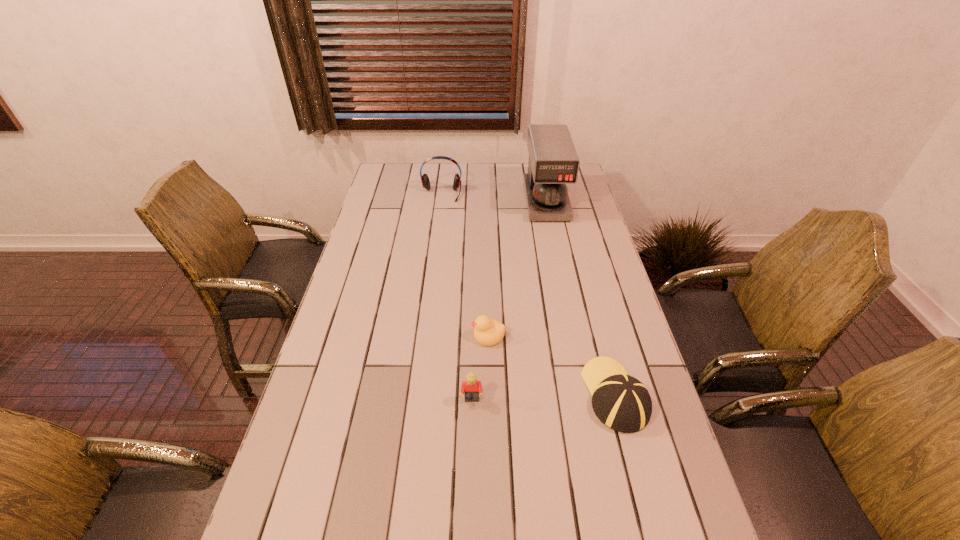
Find the location of a particular element. object that is at the far right corner is located at coordinates (553, 162).

Identify the location of vacant region at the far edge. (446, 181).

Locate an element on the screen. vacant space at the left edge is located at coordinates (357, 353).

I want to click on vacant region at the right edge, so click(684, 487).

Find the location of a particular element. vacant area that lies between the tallest object and the Lego is located at coordinates 509,300.

Locate an element on the screen. This screenshot has height=540, width=960. vacant region between the tallest object and the shortest object is located at coordinates (517, 268).

The width and height of the screenshot is (960, 540). Find the location of `vacant space in between the third farthest object and the baseball cap`. vacant space in between the third farthest object and the baseball cap is located at coordinates (552, 365).

Where is `vacant space that's between the headset and the Lego`? The image size is (960, 540). vacant space that's between the headset and the Lego is located at coordinates (457, 297).

Identify the location of vacant space in between the tallest object and the duckling. (517, 268).

Identify which object is located as the third nearest to the baseball cap. Please provide its 2D coordinates. Your answer should be formatted as a tuple, i.e. [(x, y)], where the tuple contains the x and y coordinates of a point satisfying the conditions above.

[(553, 162)]